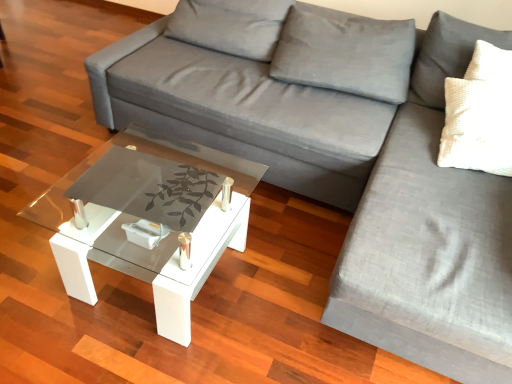
From the picture: What is the approximate width of transparent glass coffee table at center?

transparent glass coffee table at center is 22.35 inches in width.

This screenshot has width=512, height=384. What do you see at coordinates (242, 112) in the screenshot?
I see `gray fabric couch at center, the first couch when ordered from left to right` at bounding box center [242, 112].

I want to click on transparent glass coffee table at center, so click(x=160, y=242).

From the image's perspective, is gray fabric couch at right, which is the 1th couch from right to left, located above gray fabric couch at center, the first couch when ordered from left to right?

No, from the image's perspective, gray fabric couch at right, which is the 1th couch from right to left, is not over gray fabric couch at center, the first couch when ordered from left to right.

From the picture: From a real-world perspective, is gray fabric couch at right, arranged as the 2th couch when viewed from the left, beneath gray fabric couch at center, which is the second couch in right-to-left order?

Yes, from a real-world perspective, gray fabric couch at right, arranged as the 2th couch when viewed from the left, is below gray fabric couch at center, which is the second couch in right-to-left order.

Is point (411, 231) positioned after point (366, 118)?

No, (411, 231) is closer to viewer.

The image size is (512, 384). In order to click on couch on the left of gray fabric couch at right, arranged as the 2th couch when viewed from the left in this screenshot , I will do `click(242, 112)`.

Is gray fabric couch at right, arranged as the 2th couch when viewed from the left, taller or shorter than transparent glass coffee table at center?

Considering their sizes, gray fabric couch at right, arranged as the 2th couch when viewed from the left, has more height than transparent glass coffee table at center.

Which point is more forward, (422,206) or (208,154)?

The point (422,206) is closer.

Are gray fabric couch at right, which is the 1th couch from right to left, and transparent glass coffee table at center located far from each other?

No, gray fabric couch at right, which is the 1th couch from right to left, is not far from transparent glass coffee table at center.

How many degrees apart are the facing directions of gray fabric couch at right, which is the 1th couch from right to left, and transparent glass coffee table at center?

The facing directions of gray fabric couch at right, which is the 1th couch from right to left, and transparent glass coffee table at center are 0.000526 degrees apart.

Considering the relative sizes of gray fabric couch at center, the first couch when ordered from left to right, and transparent glass coffee table at center in the image provided, is gray fabric couch at center, the first couch when ordered from left to right, wider than transparent glass coffee table at center?

Yes, gray fabric couch at center, the first couch when ordered from left to right, is wider than transparent glass coffee table at center.

From the image's perspective, is gray fabric couch at center, the first couch when ordered from left to right, beneath transparent glass coffee table at center?

No, from the image's perspective, gray fabric couch at center, the first couch when ordered from left to right, is not below transparent glass coffee table at center.

Which is in front, point (143, 81) or point (238, 196)?

Positioned in front is point (238, 196).

Is gray fabric couch at center, which is the second couch in right-to-left order, in contact with transparent glass coffee table at center?

No, gray fabric couch at center, which is the second couch in right-to-left order, is not beside transparent glass coffee table at center.

Can you confirm if transparent glass coffee table at center is positioned to the right of gray fabric couch at right, which is the 1th couch from right to left?

In fact, transparent glass coffee table at center is to the left of gray fabric couch at right, which is the 1th couch from right to left.

From a real-world perspective, is transparent glass coffee table at center physically located above or below gray fabric couch at right, which is the 1th couch from right to left?

transparent glass coffee table at center is below gray fabric couch at right, which is the 1th couch from right to left.

Which point is more distant from viewer, (169, 242) or (449, 232)?

Positioned behind is point (169, 242).

Considering the relative sizes of transparent glass coffee table at center and gray fabric couch at right, which is the 1th couch from right to left, in the image provided, is transparent glass coffee table at center taller than gray fabric couch at right, which is the 1th couch from right to left,?

No.

Can you confirm if transparent glass coffee table at center is taller than gray fabric couch at center, which is the second couch in right-to-left order?

No.

How different are the orientations of transparent glass coffee table at center and gray fabric couch at center, the first couch when ordered from left to right, in degrees?

There is a 0.000513-degree angle between the facing directions of transparent glass coffee table at center and gray fabric couch at center, the first couch when ordered from left to right.

Is transparent glass coffee table at center aimed at gray fabric couch at center, which is the second couch in right-to-left order?

No, transparent glass coffee table at center is not facing towards gray fabric couch at center, which is the second couch in right-to-left order.

Consider the image. From a real-world perspective, is transparent glass coffee table at center positioned above or below gray fabric couch at center, which is the second couch in right-to-left order?

From a real-world perspective, transparent glass coffee table at center is physically below gray fabric couch at center, which is the second couch in right-to-left order.

Considering the relative sizes of gray fabric couch at center, which is the second couch in right-to-left order, and gray fabric couch at right, arranged as the 2th couch when viewed from the left, in the image provided, is gray fabric couch at center, which is the second couch in right-to-left order, taller than gray fabric couch at right, arranged as the 2th couch when viewed from the left,?

Indeed, gray fabric couch at center, which is the second couch in right-to-left order, has a greater height compared to gray fabric couch at right, arranged as the 2th couch when viewed from the left.

In the image, there is a gray fabric couch at right, arranged as the 2th couch when viewed from the left. At what (x,y) coordinates should I click in order to perform the action: click on couch above it (from the image's perspective). Please return your answer as a coordinate pair (x, y). The image size is (512, 384). Looking at the image, I should click on (242, 112).

Between point (189, 76) and point (456, 55), which one is positioned in front?

Positioned in front is point (456, 55).

Looking at this image, could you measure the distance between gray fabric couch at center, the first couch when ordered from left to right, and gray fabric couch at right, which is the 1th couch from right to left?

25.07 inches.

You are a GUI agent. You are given a task and a screenshot of the screen. Output one action in this format:
    pyautogui.click(x=<x>, y=<y>)
    Task: Click on the couch on the right of gray fabric couch at center, the first couch when ordered from left to right
    The height and width of the screenshot is (384, 512).
    Given the screenshot: What is the action you would take?
    pyautogui.click(x=431, y=235)

You are a GUI agent. You are given a task and a screenshot of the screen. Output one action in this format:
    pyautogui.click(x=<x>, y=<y>)
    Task: Click on the coffee table behind the gray fabric couch at right, which is the 1th couch from right to left
    The height and width of the screenshot is (384, 512).
    Given the screenshot: What is the action you would take?
    pyautogui.click(x=160, y=242)

From the image, which object appears to be nearer to gray fabric couch at center, the first couch when ordered from left to right, transparent glass coffee table at center or gray fabric couch at right, arranged as the 2th couch when viewed from the left?

gray fabric couch at right, arranged as the 2th couch when viewed from the left.

Based on the photo, when comparing their distances from transparent glass coffee table at center, does gray fabric couch at right, arranged as the 2th couch when viewed from the left, or gray fabric couch at center, the first couch when ordered from left to right, seem further?

gray fabric couch at right, arranged as the 2th couch when viewed from the left, lies further to transparent glass coffee table at center than the other object.

Looking at the image, which one is located further to gray fabric couch at center, which is the second couch in right-to-left order, gray fabric couch at right, which is the 1th couch from right to left, or transparent glass coffee table at center?

transparent glass coffee table at center lies further to gray fabric couch at center, which is the second couch in right-to-left order, than the other object.

When comparing their distances from gray fabric couch at right, arranged as the 2th couch when viewed from the left, does gray fabric couch at center, the first couch when ordered from left to right, or transparent glass coffee table at center seem closer?

gray fabric couch at center, the first couch when ordered from left to right, is closer to gray fabric couch at right, arranged as the 2th couch when viewed from the left.

When comparing their distances from gray fabric couch at right, arranged as the 2th couch when viewed from the left, does transparent glass coffee table at center or gray fabric couch at center, which is the second couch in right-to-left order, seem closer?

gray fabric couch at center, which is the second couch in right-to-left order, lies closer to gray fabric couch at right, arranged as the 2th couch when viewed from the left, than the other object.

Looking at the image, which one is located closer to transparent glass coffee table at center, gray fabric couch at center, which is the second couch in right-to-left order, or gray fabric couch at right, which is the 1th couch from right to left?

gray fabric couch at center, which is the second couch in right-to-left order.

Locate an element on the screen. couch between transparent glass coffee table at center and gray fabric couch at right, which is the 1th couch from right to left is located at coordinates (242, 112).